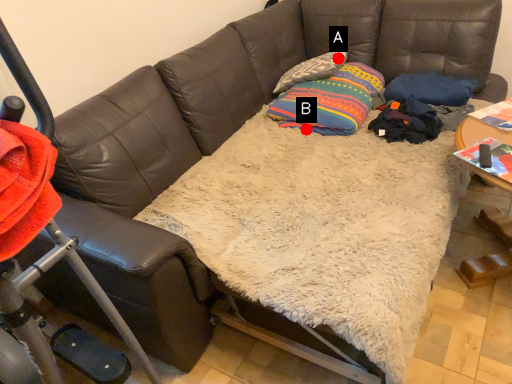
Question: Two points are circled on the image, labeled by A and B beside each circle. Among these points, which one is farthest from the camera?

Choices:
 (A) A is further
 (B) B is further

Answer: (A)